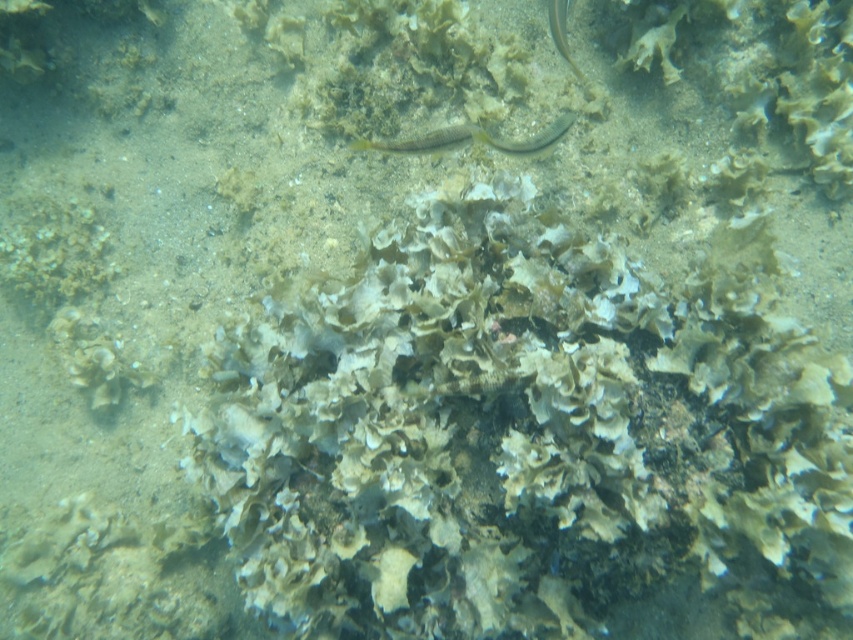
Does yellow-green translucent fish at center come in front of translucent greenish-yellow fish at upper right?

Yes.

Can you confirm if yellow-green translucent fish at center is positioned to the right of translucent greenish-yellow fish at upper right?

No, yellow-green translucent fish at center is not to the right of translucent greenish-yellow fish at upper right.

This screenshot has height=640, width=853. Find the location of `yellow-green translucent fish at center`. yellow-green translucent fish at center is located at coordinates (469, 140).